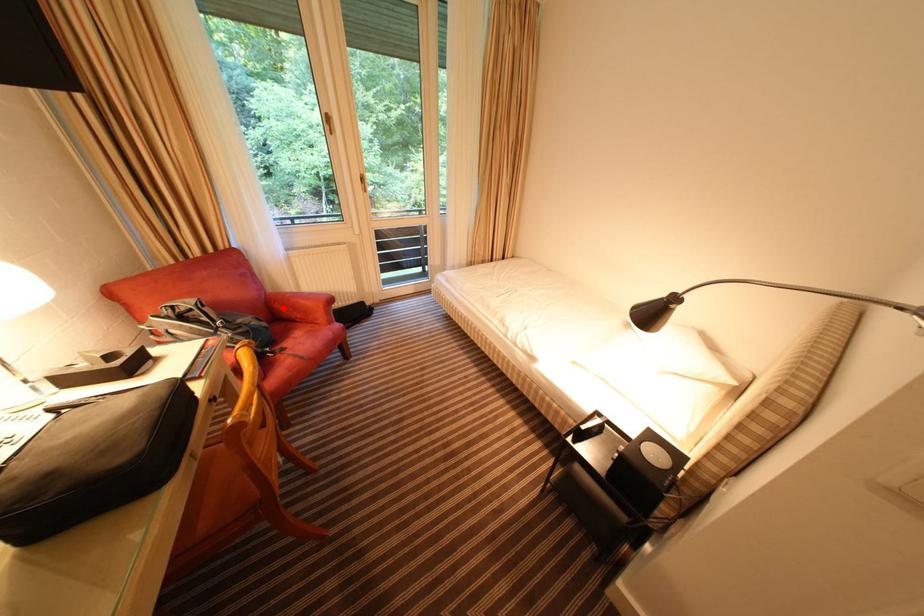
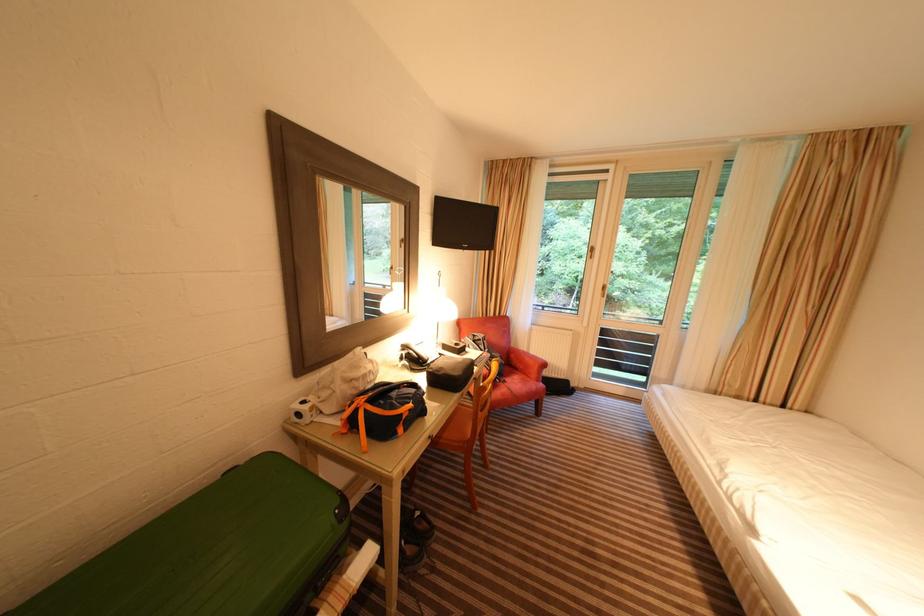
Question: I am providing you with two images of the same scene from different viewpoints. A red point is shown in image1. For the corresponding object point in image2, is it positioned nearer or farther from the camera?

Choices:
 (A) Nearer
 (B) Farther

Answer: (B)